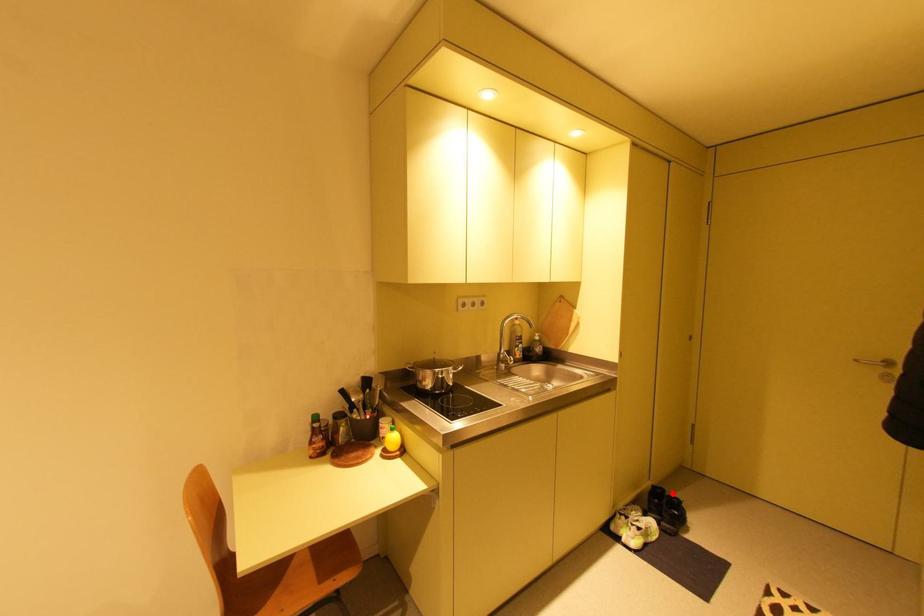
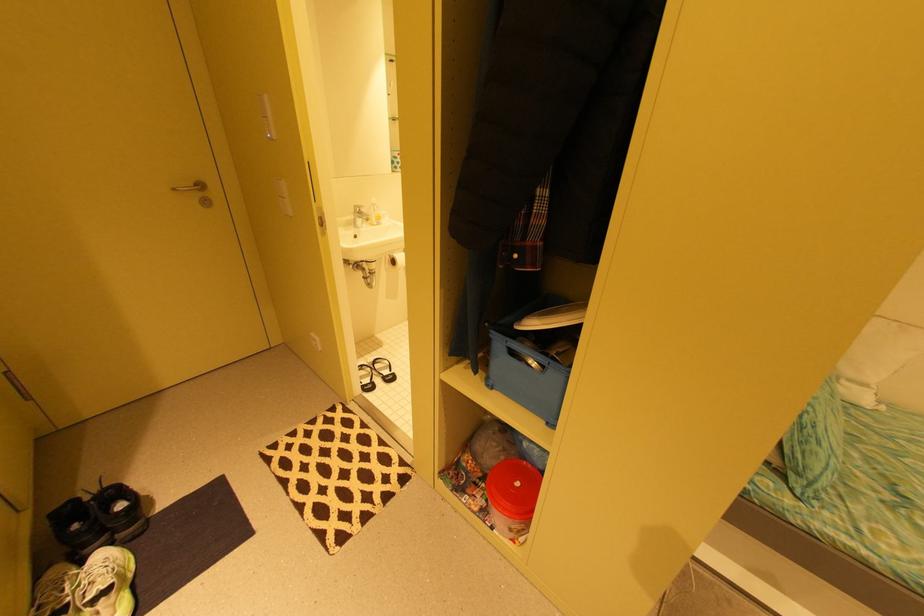
Find the pixel in the second image that matches the highlighted location in the first image.

(93, 499)